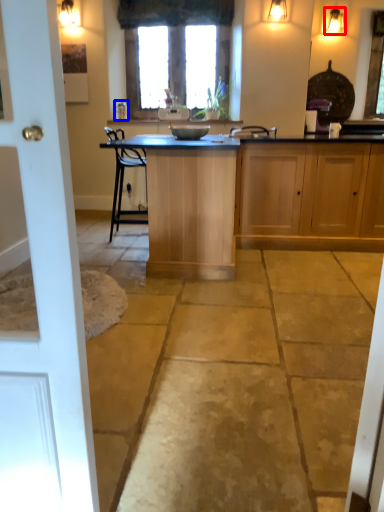
Question: Which object appears farthest to the camera in this image, light fixture (highlighted by a red box) or faucet (highlighted by a blue box)?

Choices:
 (A) light fixture
 (B) faucet

Answer: (B)